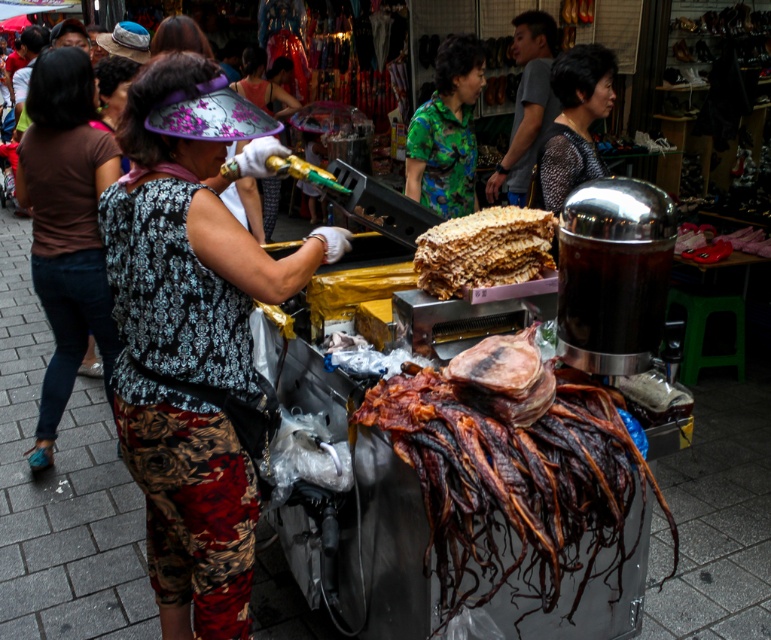
Is patterned fabric headwear at center to the left of crumbly golden cake at center from the viewer's perspective?

Correct, you'll find patterned fabric headwear at center to the left of crumbly golden cake at center.

Describe the element at coordinates (192, 333) in the screenshot. Image resolution: width=771 pixels, height=640 pixels. I see `patterned fabric headwear at center` at that location.

Who is more distant from viewer, (177, 145) or (493, 224)?

Point (493, 224)

Identify the location of patterned fabric headwear at center. This screenshot has width=771, height=640. coord(192,333).

Who is positioned more to the right, brown leather jerky at center or brown fabric shirt at left?

Positioned to the right is brown leather jerky at center.

This screenshot has width=771, height=640. What do you see at coordinates (514, 470) in the screenshot?
I see `brown leather jerky at center` at bounding box center [514, 470].

Where is `brown leather jerky at center`? The width and height of the screenshot is (771, 640). brown leather jerky at center is located at coordinates (514, 470).

Which is in front, point (581, 116) or point (234, 148)?

Point (234, 148)

In the scene shown: Who is positioned more to the right, black dotted blouse at upper center or patterned fabric headband at center?

black dotted blouse at upper center

Where is `black dotted blouse at upper center`? black dotted blouse at upper center is located at coordinates click(x=574, y=122).